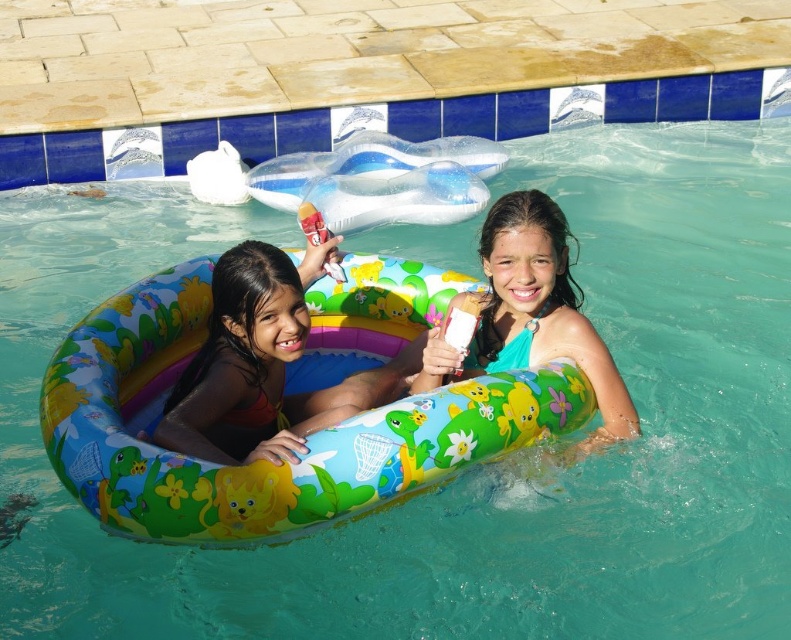
Which is more to the right, multicolored inflatable ring at center or multicolored rubber ring at center?

Positioned to the right is multicolored inflatable ring at center.

Is multicolored inflatable ring at center smaller than multicolored rubber ring at center?

Incorrect, multicolored inflatable ring at center is not smaller in size than multicolored rubber ring at center.

Does point (361, 381) lie behind point (176, 445)?

Yes, it is behind point (176, 445).

In order to click on multicolored inflatable ring at center in this screenshot , I will do `click(517, 321)`.